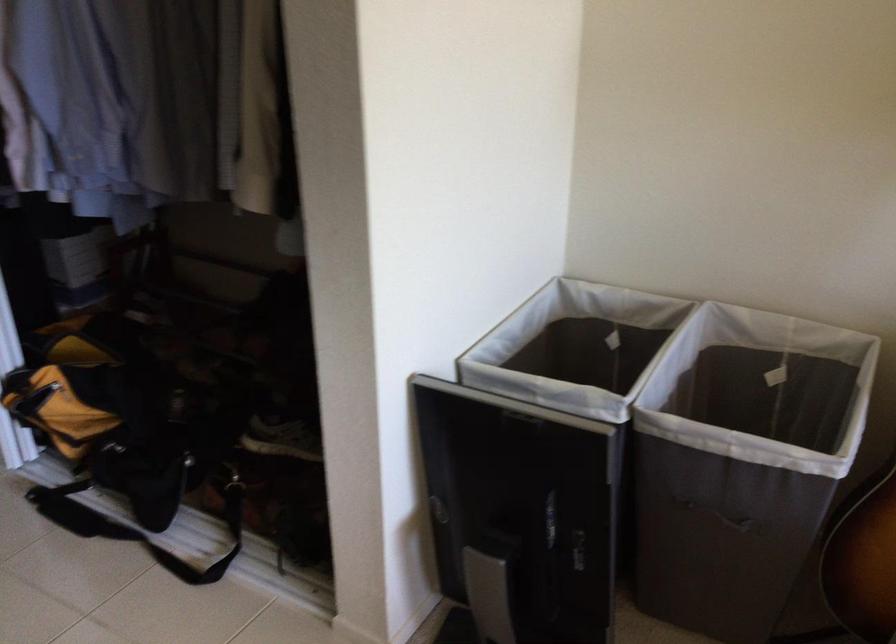
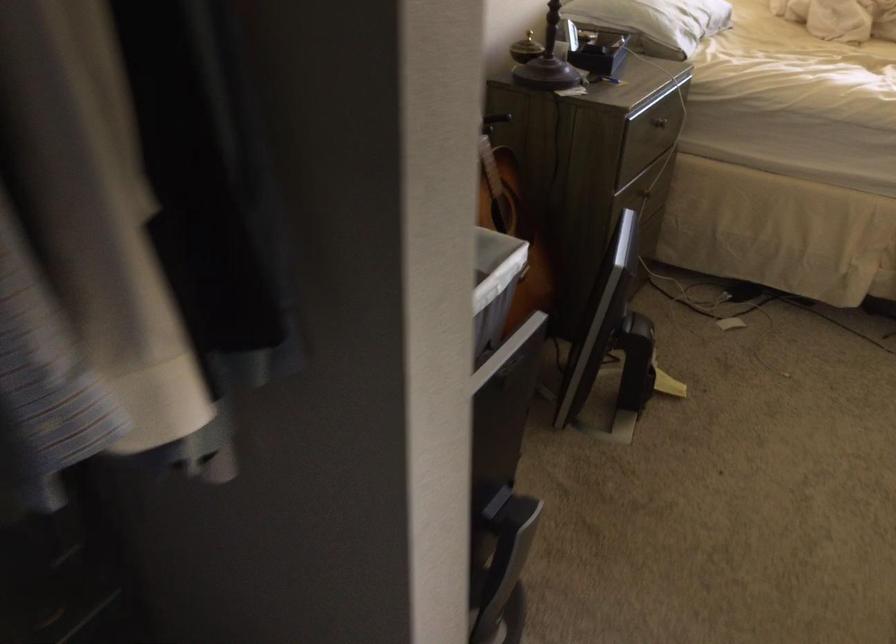
Question: I am providing you with two images of the same scene from different viewpoints. After the viewpoint changes to image2, which objects are now occluded?

Choices:
 (A) patterned bolster pillow
 (B) acoustic guitar
 (C) laundry hamper handle
 (D) drawer knob

Answer: (C)